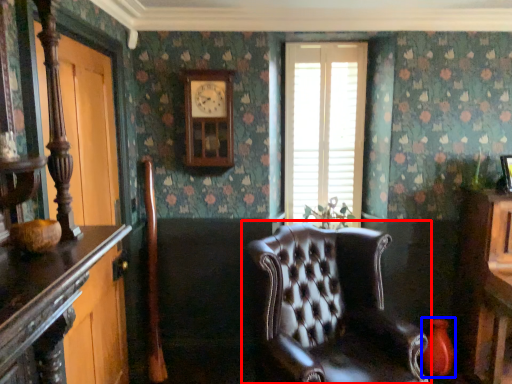
Question: Which object appears closest to the camera in this image, chair (highlighted by a red box) or vase (highlighted by a blue box)?

Choices:
 (A) chair
 (B) vase

Answer: (A)